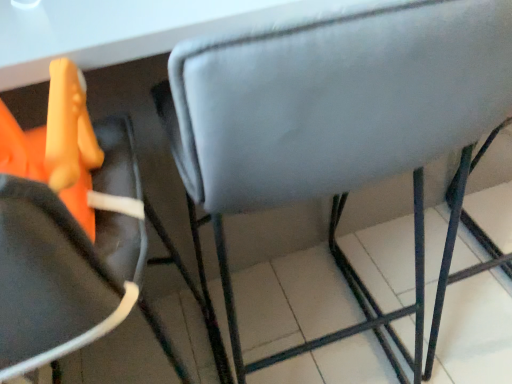
Question: Choose the correct answer: Is matte gray cushion at center, acting as the 2th chair starting from the right, inside velvet-like gray chair at center, the 2th chair viewed from the left, or outside it?

Choices:
 (A) outside
 (B) inside

Answer: (A)

Question: From the image's perspective, relative to velvet-like gray chair at center, the 2th chair viewed from the left, is matte gray cushion at center, positioned as the 1th chair in left-to-right order, above or below?

Choices:
 (A) above
 (B) below

Answer: (B)

Question: Considering their positions, is matte gray cushion at center, positioned as the 1th chair in left-to-right order, located in front of or behind velvet-like gray chair at center, the 2th chair viewed from the left?

Choices:
 (A) front
 (B) behind

Answer: (A)

Question: Is velvet-like gray chair at center, which is the 1th chair from right to left, taller or shorter than matte gray cushion at center, positioned as the 1th chair in left-to-right order?

Choices:
 (A) short
 (B) tall

Answer: (A)

Question: Choose the correct answer: Is velvet-like gray chair at center, the 2th chair viewed from the left, inside matte gray cushion at center, acting as the 2th chair starting from the right, or outside it?

Choices:
 (A) inside
 (B) outside

Answer: (B)

Question: From the image's perspective, is velvet-like gray chair at center, which is the 1th chair from right to left, located above or below matte gray cushion at center, acting as the 2th chair starting from the right?

Choices:
 (A) below
 (B) above

Answer: (B)

Question: Does point (437, 312) appear closer or farther from the camera than point (35, 147)?

Choices:
 (A) farther
 (B) closer

Answer: (A)